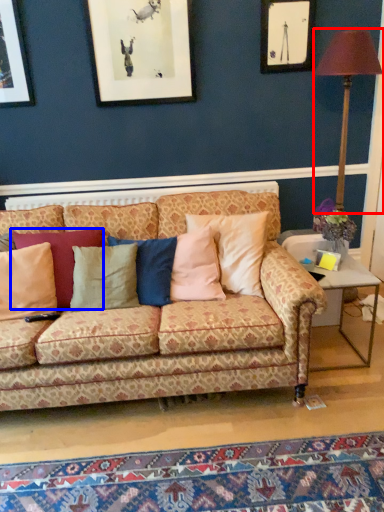
Question: Which object appears farthest to the camera in this image, table lamp (highlighted by a red box) or pillow (highlighted by a blue box)?

Choices:
 (A) table lamp
 (B) pillow

Answer: (A)